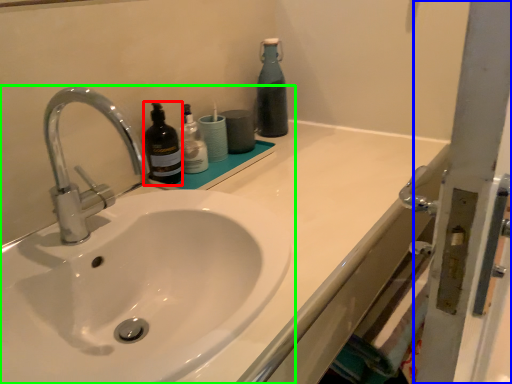
Question: Based on their relative distances, which object is nearer to bottle (highlighted by a red box)? Choose from screen door (highlighted by a blue box) and sink (highlighted by a green box).

Choices:
 (A) screen door
 (B) sink

Answer: (B)